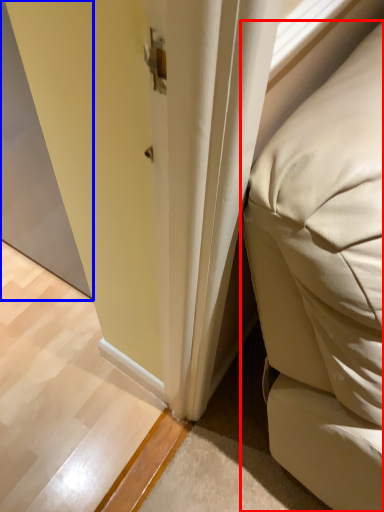
Question: Which object appears closest to the camera in this image, furniture (highlighted by a red box) or screen door (highlighted by a blue box)?

Choices:
 (A) furniture
 (B) screen door

Answer: (A)